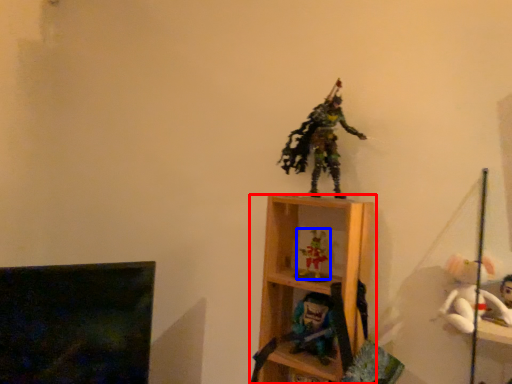
Question: Among these objects, which one is farthest to the camera, shelf (highlighted by a red box) or toy (highlighted by a blue box)?

Choices:
 (A) shelf
 (B) toy

Answer: (B)